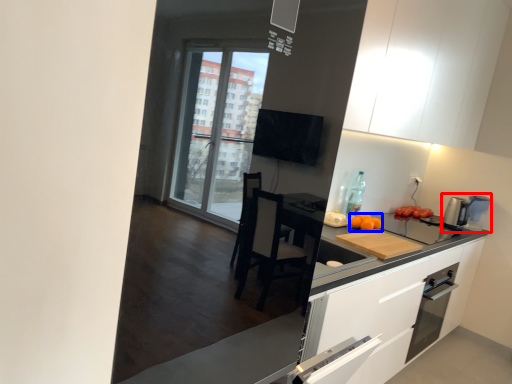
Question: Which object is closer to the camera taking this photo, coffee machine (highlighted by a red box) or orange (highlighted by a blue box)?

Choices:
 (A) coffee machine
 (B) orange

Answer: (B)